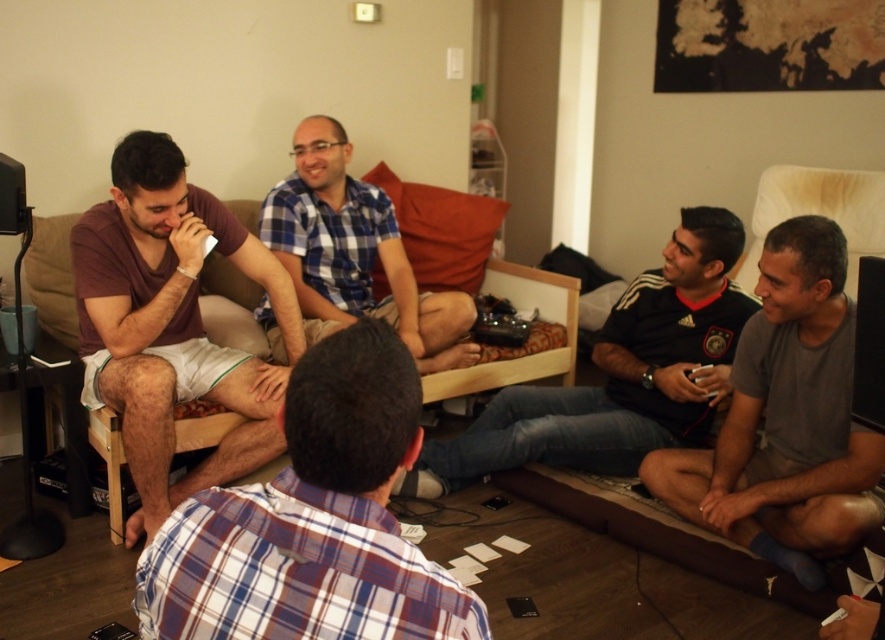
In the living room scene, there are several men wearing different shirts. You are standing at the origin point of the room. Where is the gray cotton shirt at lower right located relative to your position?

The gray cotton shirt at lower right is located at coordinates point (786, 419) relative to the origin point.

You are trying to hang a picture frame that is 1 meter wide on the wall. You see the dark gray jersey at center and the brown fabric couch at upper center in the room. Which object should you avoid placing the frame near to ensure it doesn not block the view of the couch?

The dark gray jersey at center might be wider than the brown fabric couch at upper center, so you should avoid placing the frame near the dark gray jersey at center to prevent blocking the view of the couch.